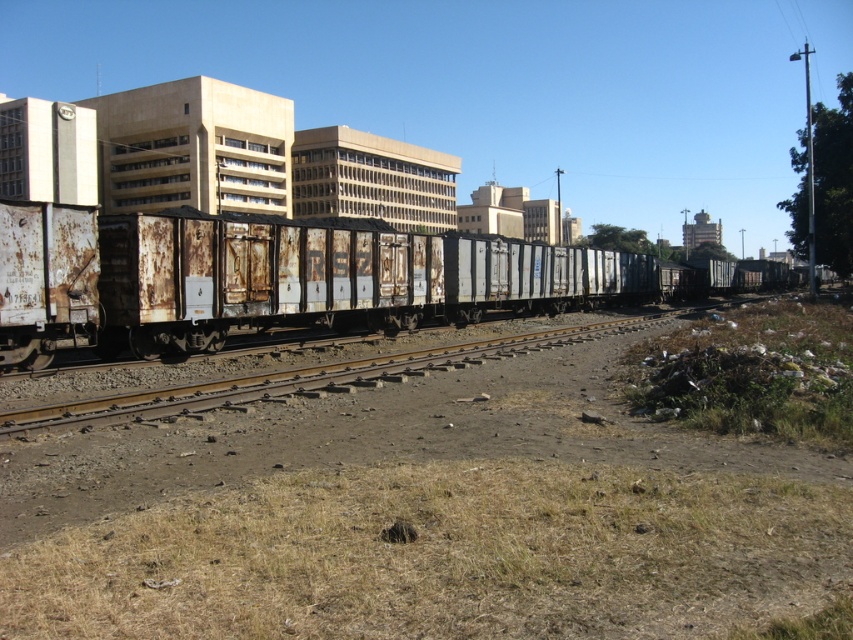
You are standing on the dirt path next to the railway tracks and see the rusty metal train carriages at left and the rusty metal train carriages at center. Which one is closer to your right side?

The rusty metal train carriages at left is to the right of the rusty metal train carriages at center, so the rusty metal train carriages at left is closer to your right side.

You are a railway inspector checking the train for maintenance. You need to compare the sizes of the rusty metal train carriages at left and the rusty metal train carriages at center. Which one is wider?

The rusty metal train carriages at left are wider than the rusty metal train carriages at center because the description states that the rusty metal train carriages at left surpass the width of the rusty metal train carriages at center.

You are a surveyor checking the railway tracks. You notice a point marked at coordinates [265,280]. Based on the scene, what does this point indicate?

The point at coordinates [265,280] marks the location of rusty metal train carriages at left.